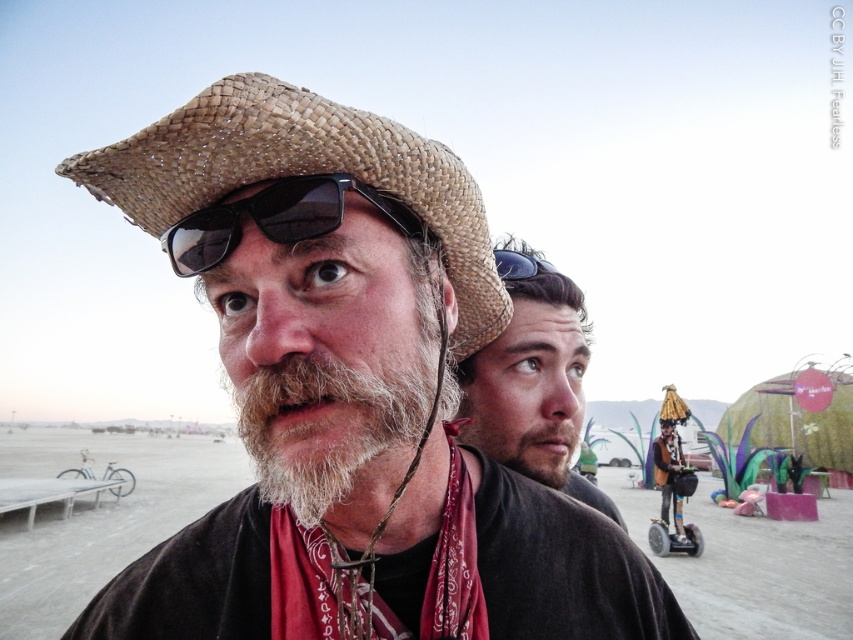
You are a photographer trying to capture a clear shot of both the woven straw cowboy hat at center and the black matte sunglasses at upper center. Since you want both items in focus, which one should you adjust your camera focus on first to ensure the other is also in focus?

The woven straw cowboy hat at center is closer to the viewer than the black matte sunglasses at upper center. To ensure both are in focus, focus on the farther object, which is the black matte sunglasses at upper center. This way, the closer object will naturally fall into the depth of field range.

You are standing at the center of the image and want to pick up the beige straw hat at center. In which direction should you move to reach it?

The beige straw hat at center is located at point coordinates of [534,388]. Since you are at the center, you should move towards the right and slightly upward to reach it.